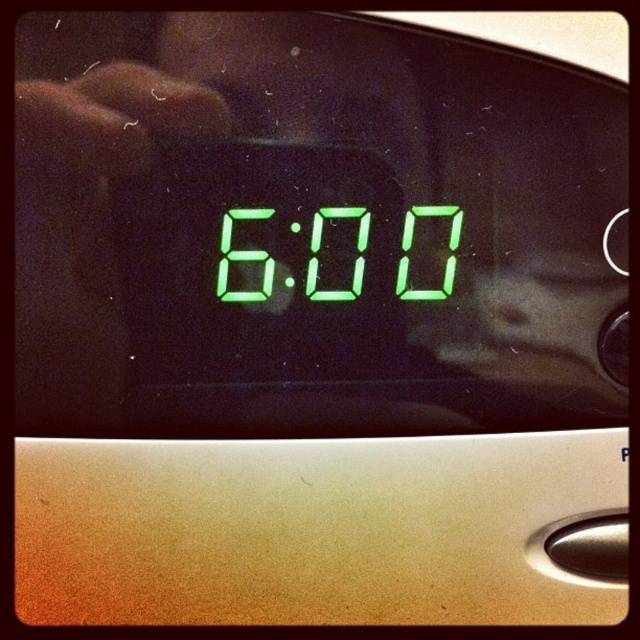
Question: Among these points, which one is nearest to the camera?

Choices:
 (A) (228, 253)
 (B) (307, 296)
 (C) (445, 269)

Answer: (A)

Question: Which of the following is the closest to the observer?

Choices:
 (A) green digital at center
 (B) green digital display at center

Answer: (A)

Question: Which of these objects is positioned farthest from the green digital clock at center?

Choices:
 (A) green digital at center
 (B) green digital display at center

Answer: (A)

Question: Is green digital display at center smaller than green digital at center?

Choices:
 (A) no
 (B) yes

Answer: (A)

Question: Does green digital display at center have a greater width compared to green digital at center?

Choices:
 (A) no
 (B) yes

Answer: (B)

Question: Does green digital clock at center have a larger size compared to green digital at center?

Choices:
 (A) no
 (B) yes

Answer: (B)